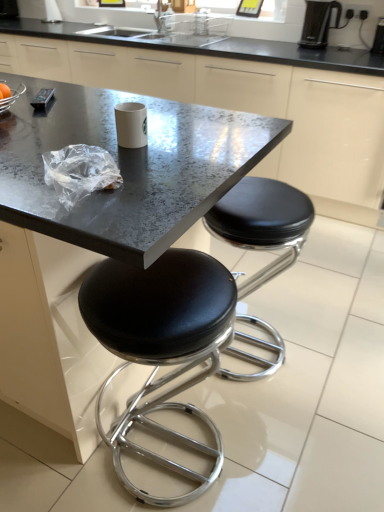
Question: Should I look upward or downward to see black plastic coffee machine at upper right?

Choices:
 (A) down
 (B) up

Answer: (B)

Question: Is the position of black plastic coffee machine at upper right less distant than that of black leather stool at lower center, the second stool viewed from the right?

Choices:
 (A) no
 (B) yes

Answer: (A)

Question: Is black leather stool at lower center, the 1th stool in the left-to-right sequence, located within black plastic coffee machine at upper right?

Choices:
 (A) no
 (B) yes

Answer: (A)

Question: Is black plastic coffee machine at upper right oriented towards black leather stool at lower center, the second stool viewed from the right?

Choices:
 (A) yes
 (B) no

Answer: (A)

Question: Can you confirm if black plastic coffee machine at upper right is positioned to the right of black leather stool at lower center, the second stool viewed from the right?

Choices:
 (A) yes
 (B) no

Answer: (A)

Question: Can you confirm if black plastic coffee machine at upper right is shorter than black leather stool at lower center, the 1th stool in the left-to-right sequence?

Choices:
 (A) yes
 (B) no

Answer: (A)

Question: Does black plastic coffee machine at upper right have a greater height compared to black leather stool at lower center, the second stool viewed from the right?

Choices:
 (A) no
 (B) yes

Answer: (A)

Question: From the image's perspective, is black granite countertop at center over black plastic coffee machine at upper right?

Choices:
 (A) no
 (B) yes

Answer: (A)

Question: From a real-world perspective, is black granite countertop at center positioned under black plastic coffee machine at upper right based on gravity?

Choices:
 (A) yes
 (B) no

Answer: (A)

Question: From a real-world perspective, is black granite countertop at center on black plastic coffee machine at upper right?

Choices:
 (A) no
 (B) yes

Answer: (A)

Question: Does black granite countertop at center contain black plastic coffee machine at upper right?

Choices:
 (A) no
 (B) yes

Answer: (A)

Question: Can you confirm if black granite countertop at center is thinner than black plastic coffee machine at upper right?

Choices:
 (A) no
 (B) yes

Answer: (A)

Question: Is black granite countertop at center positioned before black plastic coffee machine at upper right?

Choices:
 (A) yes
 (B) no

Answer: (A)

Question: Does metallic gray table at center come in front of white glossy paper cup at center?

Choices:
 (A) yes
 (B) no

Answer: (A)